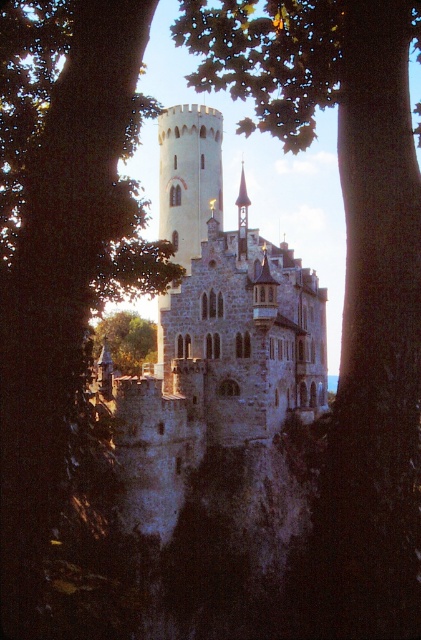
From the perspective of someone standing in front of the stone castle at center, which direction would the green leafy tree at lower left be located relative to them?

The green leafy tree at lower left is to the left of the stone castle at center from the observer standing in front of it.

You are standing in a forest clearing and see the stone castle at center and the green leafy tree at lower left. Which object is nearer to you?

The stone castle at center is closer to the viewer than the green leafy tree at lower left.